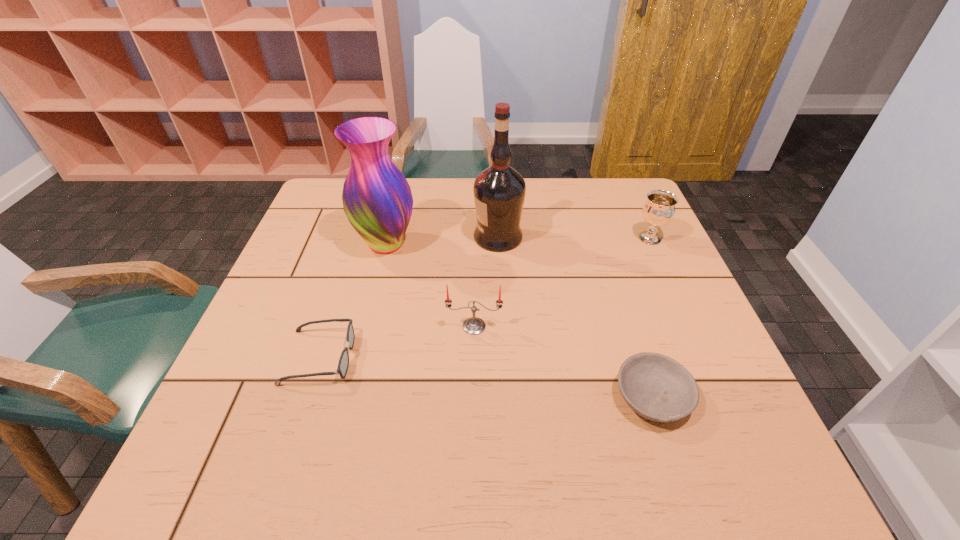
I want to click on empty space that is in between the liquor and the rightmost object, so click(x=574, y=238).

Locate an element on the screen. The height and width of the screenshot is (540, 960). vacant region between the candle and the liquor is located at coordinates (486, 282).

Locate an element on the screen. The width and height of the screenshot is (960, 540). vacant area between the spectacles and the vase is located at coordinates (353, 301).

Identify which object is located as the nearest to the vase. Please provide its 2D coordinates. Your answer should be formatted as a tuple, i.e. [(x, y)], where the tuple contains the x and y coordinates of a point satisfying the conditions above.

[(499, 191)]

Locate an element on the screen. The image size is (960, 540). object that can be found as the second closest to the candle is located at coordinates (377, 199).

At what (x,y) coordinates should I click in order to perform the action: click on vacant region that satisfies the following two spatial constraints: 1. on the surface of the liquor; 2. on the left side of the bowl. Please return your answer as a coordinate pair (x, y). Looking at the image, I should click on (506, 397).

At what (x,y) coordinates should I click in order to perform the action: click on vacant area in the image that satisfies the following two spatial constraints: 1. on the back side of the chalice; 2. on the right side of the vase. Please return your answer as a coordinate pair (x, y). This screenshot has width=960, height=540. Looking at the image, I should click on tap(388, 238).

Identify the location of free region that satisfies the following two spatial constraints: 1. on the surface of the bowl; 2. on the right side of the liquor. (506, 397).